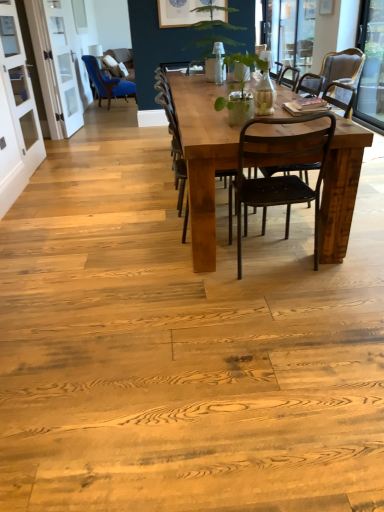
In order to face white glass screen door at upper left, arranged as the 2th screen door when viewed from the front, should I rotate leftwards or rightwards?

A 16.760 degree turn to the left will do.

The height and width of the screenshot is (512, 384). I want to click on matte black chair at right, which appears as the second chair when viewed from the back, so (336, 79).

In order to face rustic wood table at center, should I rotate leftwards or rightwards?

Turn right by 5.360 degrees to look at rustic wood table at center.

The width and height of the screenshot is (384, 512). What do you see at coordinates (213, 17) in the screenshot?
I see `green matte vase at center` at bounding box center [213, 17].

Identify the location of matte black chair at center, which is the fifth chair from back to front. (278, 176).

The width and height of the screenshot is (384, 512). I want to click on white glass screen door at upper left, positioned as the 1th screen door in back-to-front order, so click(63, 69).

Which point is more forward, (9, 113) or (343, 89)?

The point (9, 113) is closer to the camera.

Which screen door is the 1st one when counting from the left side of the matte black chair at right, which appears as the second chair when viewed from the back? Please provide its 2D coordinates.

[(16, 112)]

From their relative heights in the image, would you say white glass screen door at left, positioned as the first screen door in front-to-back order, is taller or shorter than matte black chair at right, the 1th chair when ordered from right to left?

In the image, white glass screen door at left, positioned as the first screen door in front-to-back order, appears to be taller than matte black chair at right, the 1th chair when ordered from right to left.

Does white glass screen door at left, which ranks as the second screen door in back-to-front order, have a larger size compared to matte black chair at right, which appears as the second chair when viewed from the back?

No, white glass screen door at left, which ranks as the second screen door in back-to-front order, is not bigger than matte black chair at right, which appears as the second chair when viewed from the back.

Looking at this image, what's the angular difference between white glass screen door at upper left, arranged as the 2th screen door when viewed from the front, and transparent glass window screen at right, the second window screen viewed from the left,'s facing directions?

The angular difference between white glass screen door at upper left, arranged as the 2th screen door when viewed from the front, and transparent glass window screen at right, the second window screen viewed from the left, is 173 degrees.

From a real-world perspective, is white glass screen door at upper left, positioned as the 1th screen door in back-to-front order, physically below transparent glass window screen at right, positioned as the 1th window screen in bottom-to-top order?

No, from a real-world perspective, white glass screen door at upper left, positioned as the 1th screen door in back-to-front order, is not beneath transparent glass window screen at right, positioned as the 1th window screen in bottom-to-top order.

In the scene shown: Is there a large distance between white glass screen door at upper left, arranged as the 2th screen door when viewed from the front, and transparent glass window screen at right, which ranks as the first window screen in front-to-back order?

That's right, there is a large distance between white glass screen door at upper left, arranged as the 2th screen door when viewed from the front, and transparent glass window screen at right, which ranks as the first window screen in front-to-back order.

Is the position of white glass screen door at upper left, arranged as the 2th screen door when viewed from the front, more distant than that of transparent glass window screen at right, the second window screen viewed from the left?

Yes, white glass screen door at upper left, arranged as the 2th screen door when viewed from the front, is further from the viewer.

In terms of height, does matte black chair at center, which ranks as the 3th chair in back-to-front order, look taller or shorter compared to blue velvet chair at left, acting as the first chair starting from the back?

In the image, matte black chair at center, which ranks as the 3th chair in back-to-front order, appears to be taller than blue velvet chair at left, acting as the first chair starting from the back.

From a real-world perspective, who is located lower, matte black chair at center, which ranks as the 3th chair in back-to-front order, or blue velvet chair at left, the fifth chair positioned from the right?

blue velvet chair at left, the fifth chair positioned from the right.

Measure the distance from matte black chair at center, which ranks as the 3th chair in back-to-front order, to blue velvet chair at left, the fifth chair from the front.

matte black chair at center, which ranks as the 3th chair in back-to-front order, is 14.14 feet away from blue velvet chair at left, the fifth chair from the front.

Consider the image. Is matte black chair at center, which is counted as the third chair, starting from the front, placed right next to blue velvet chair at left, the 1th chair when ordered from left to right?

matte black chair at center, which is counted as the third chair, starting from the front, and blue velvet chair at left, the 1th chair when ordered from left to right, are not in contact.

In terms of size, does rustic wood chair at center, which is the second chair in front-to-back order, appear bigger or smaller than matte black chair at center, which ranks as the 3th chair in back-to-front order?

Clearly, rustic wood chair at center, which is the second chair in front-to-back order, is smaller in size than matte black chair at center, which ranks as the 3th chair in back-to-front order.

From the image's perspective, is rustic wood chair at center, placed as the second chair when sorted from left to right, located above matte black chair at center, which is counted as the third chair, starting from the front?

No, from the image's perspective, rustic wood chair at center, placed as the second chair when sorted from left to right, is not above matte black chair at center, which is counted as the third chair, starting from the front.

From a real-world perspective, is rustic wood chair at center, which is the second chair in front-to-back order, physically below matte black chair at center, which is counted as the third chair, starting from the front?

Answer: Actually, rustic wood chair at center, which is the second chair in front-to-back order, is physically above matte black chair at center, which is counted as the third chair, starting from the front, in the real world.

From the image's perspective, is transparent glass window screen at right, the second window screen viewed from the left, on top of transparent glass window at upper right, the second window screen in the right-to-left sequence?

No, from the image's perspective, transparent glass window screen at right, the second window screen viewed from the left, is not over transparent glass window at upper right, the second window screen in the right-to-left sequence.

Could you tell me if transparent glass window screen at right, the second window screen viewed from the left, is facing transparent glass window at upper right, placed as the 1th window screen when sorted from top to bottom?

No, transparent glass window screen at right, the second window screen viewed from the left, is not turned towards transparent glass window at upper right, placed as the 1th window screen when sorted from top to bottom.

Can you confirm if transparent glass window screen at right, the second window screen viewed from the top, is taller than transparent glass window at upper right, which is the 1th window screen in left-to-right order?

Yes, transparent glass window screen at right, the second window screen viewed from the top, is taller than transparent glass window at upper right, which is the 1th window screen in left-to-right order.

Is rustic wood table at center far from transparent glass window screen at right, the second window screen viewed from the top?

rustic wood table at center is far away from transparent glass window screen at right, the second window screen viewed from the top.

From a real-world perspective, does rustic wood table at center sit lower than transparent glass window screen at right, the second window screen viewed from the left?

Indeed, from a real-world perspective, rustic wood table at center is positioned beneath transparent glass window screen at right, the second window screen viewed from the left.

Is rustic wood table at center looking in the opposite direction of transparent glass window screen at right, the first window screen when ordered from right to left?

rustic wood table at center does not have its back to transparent glass window screen at right, the first window screen when ordered from right to left.

The height and width of the screenshot is (512, 384). There is a transparent glass window at upper right, which ranks as the first window screen in back-to-front order. Find the location of `the 4th chair below it (from the image's perspective)`. the 4th chair below it (from the image's perspective) is located at coordinates (173, 140).

How distant is rustic wood chair at center, the fourth chair viewed from the right, from transparent glass window at upper right, which is the 1th window screen in left-to-right order?

rustic wood chair at center, the fourth chair viewed from the right, and transparent glass window at upper right, which is the 1th window screen in left-to-right order, are 2.84 meters apart.

Looking at this image, does rustic wood chair at center, the fourth chair when ordered from back to front, appear on the left side of transparent glass window at upper right, placed as the 1th window screen when sorted from top to bottom?

Indeed, rustic wood chair at center, the fourth chair when ordered from back to front, is positioned on the left side of transparent glass window at upper right, placed as the 1th window screen when sorted from top to bottom.

Is transparent glass window at upper right, the second window screen viewed from the front, completely or partially inside rustic wood chair at center, the fourth chair when ordered from back to front?

No, rustic wood chair at center, the fourth chair when ordered from back to front, does not contain transparent glass window at upper right, the second window screen viewed from the front.

You are a GUI agent. You are given a task and a screenshot of the screen. Output one action in this format:
    pyautogui.click(x=<x>, y=<y>)
    Task: Click on the 1st screen door counting from the left side of the matte black chair at right, which is counted as the fourth chair, starting from the front
    The image size is (384, 512).
    Given the screenshot: What is the action you would take?
    pyautogui.click(x=16, y=112)

The image size is (384, 512). Identify the location of screen door that is the 2nd object above the transparent glass window screen at right, the second window screen from the back (from a real-world perspective). (63, 69).

Based on their spatial positions, is white glass screen door at upper left, arranged as the 2th screen door when viewed from the front, or matte black chair at right, which is the 5th chair in left-to-right order, further from transparent glass window at upper right, which ranks as the first window screen in back-to-front order?

white glass screen door at upper left, arranged as the 2th screen door when viewed from the front, is positioned further to the anchor transparent glass window at upper right, which ranks as the first window screen in back-to-front order.

Considering their positions, is matte black chair at center, the second chair when ordered from right to left, positioned closer to transparent glass window screen at right, positioned as the 1th window screen in bottom-to-top order, than matte black chair at right, the 1th chair when ordered from right to left?

Based on the image, matte black chair at right, the 1th chair when ordered from right to left, appears to be nearer to transparent glass window screen at right, positioned as the 1th window screen in bottom-to-top order.

Based on their spatial positions, is rustic wood chair at center, which is the second chair in front-to-back order, or green matte vase at center further from matte black chair at center, which is the fifth chair from back to front?

Based on the image, green matte vase at center appears to be further to matte black chair at center, which is the fifth chair from back to front.

Based on their spatial positions, is transparent glass window screen at right, the second window screen viewed from the left, or blue velvet chair at left, the fifth chair positioned from the right, further from matte black chair at right, which appears as the second chair when viewed from the back?

blue velvet chair at left, the fifth chair positioned from the right, is further to matte black chair at right, which appears as the second chair when viewed from the back.

Looking at the image, which one is located closer to green matte vase at center, rustic wood chair at center, placed as the second chair when sorted from left to right, or white glass screen door at upper left, arranged as the 2th screen door when viewed from the front?

white glass screen door at upper left, arranged as the 2th screen door when viewed from the front.

Consider the image. From the image, which object appears to be farther from white glass screen door at upper left, arranged as the 2th screen door when viewed from the front, green matte vase at center or rustic wood table at center?

rustic wood table at center lies further to white glass screen door at upper left, arranged as the 2th screen door when viewed from the front, than the other object.

Which object lies further to the anchor point matte black chair at center, placed as the 4th chair when sorted from left to right, matte black chair at center, which ranks as the third chair in left-to-right order, or green matte vase at center?

matte black chair at center, which ranks as the third chair in left-to-right order, is positioned further to the anchor matte black chair at center, placed as the 4th chair when sorted from left to right.

In the scene shown: Which object lies further to the anchor point rustic wood table at center, transparent glass window at upper right, which ranks as the first window screen in back-to-front order, or matte black chair at center, which is counted as the third chair, starting from the front?

matte black chair at center, which is counted as the third chair, starting from the front, is positioned further to the anchor rustic wood table at center.

Locate an element on the screen. The image size is (384, 512). screen door between white glass screen door at upper left, arranged as the 2th screen door when viewed from the front, and transparent glass window at upper right, the second window screen in the right-to-left sequence is located at coordinates (16, 112).

Image resolution: width=384 pixels, height=512 pixels. Identify the location of houseplant located between matte black chair at center, acting as the first chair starting from the front, and transparent glass window screen at right, the second window screen viewed from the top, in the depth direction. (213, 17).

Image resolution: width=384 pixels, height=512 pixels. In order to click on houseplant between white glass screen door at left, which ranks as the second screen door in back-to-front order, and matte black chair at right, the 1th chair when ordered from right to left, in the horizontal direction in this screenshot , I will do `click(213, 17)`.

Find the location of a particular element. The image size is (384, 512). houseplant between matte black chair at center, which is the third chair in right-to-left order, and white glass screen door at upper left, arranged as the 2th screen door when viewed from the front, along the z-axis is located at coordinates (213, 17).